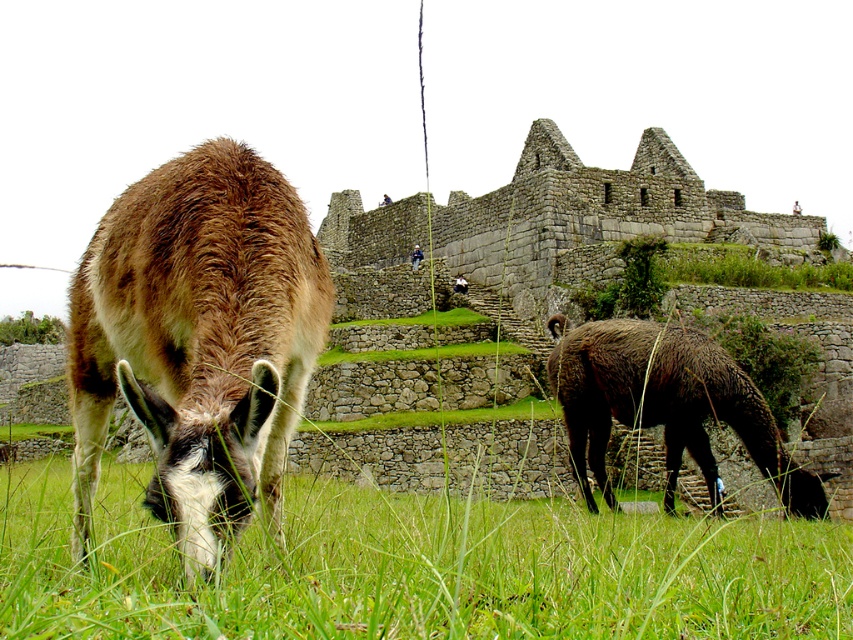
You are standing in the field where the alpacas are grazing. You notice two points marked in the scene. The first point is at coordinates point (233, 388) and the second is at point (619, 371). Which of these points is closer to you?

Point (233, 388) is closer to the viewer than point (619, 371).

You are a photographer trying to capture both the brown woolen llama at lower left and the dark brown woolen llama at right in a single frame. Based on their heights, which llama should you focus on first to ensure both are fully visible in the photo?

The brown woolen llama at lower left is not as tall as the dark brown woolen llama at right. To ensure both are fully visible, focus on the taller dark brown woolen llama at right first, then adjust the frame to include the shorter brown woolen llama at lower left.

You are a photographer trying to capture both the brown woolen llama at lower left and the dark brown woolen llama at right in a single frame. Based on their positions, which llama is closer to the camera?

The brown woolen llama at lower left is closer to the camera than the dark brown woolen llama at right because it is positioned in the foreground.